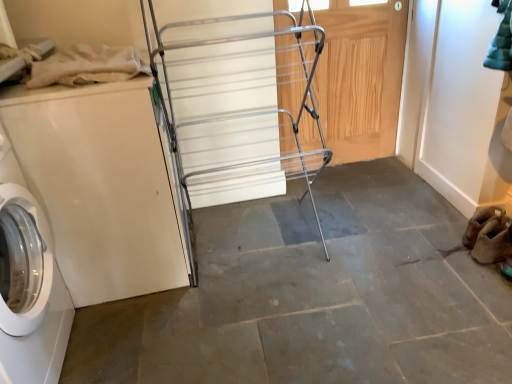
Locate an element on the screen. blank area beneath silver metallic drying rack at center (from a real-world perspective) is located at coordinates (252, 245).